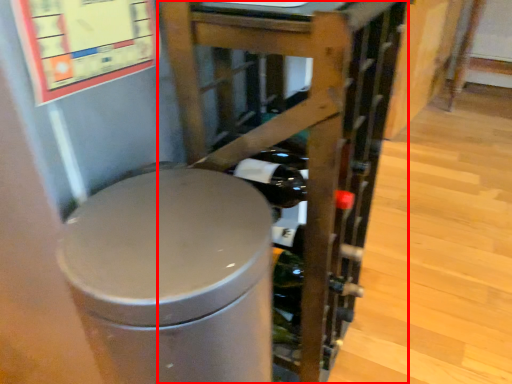
Question: Where is furniture (annotated by the red box) located in relation to waste container in the image?

Choices:
 (A) left
 (B) right

Answer: (B)